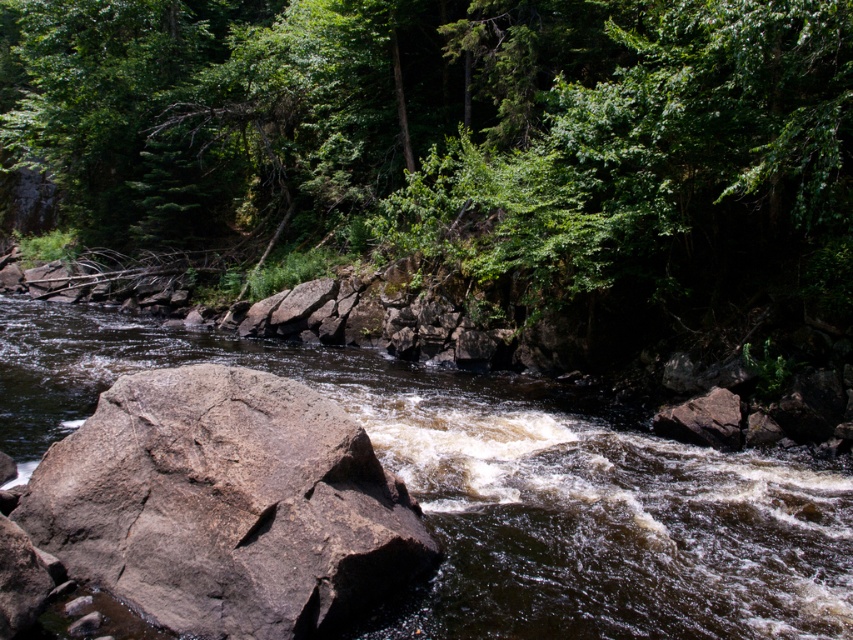
Which is in front, point (846, 220) or point (838, 580)?

Point (838, 580)

Who is positioned more to the right, green leafy tree at upper center or brown rock at center?

Positioned to the right is brown rock at center.

Where is `green leafy tree at upper center`? The image size is (853, 640). green leafy tree at upper center is located at coordinates (457, 134).

Is green leafy tree at upper center wider than gray rough rock at center?

Yes.

Is point (190, 60) less distant than point (189, 384)?

No, it is behind (189, 384).

The image size is (853, 640). I want to click on green leafy tree at upper center, so click(457, 134).

Can you confirm if brown rock at center is taller than gray rough rock at center?

Correct, brown rock at center is much taller as gray rough rock at center.

Does point (61, 403) come in front of point (247, 554)?

No, (61, 403) is further to viewer.

Image resolution: width=853 pixels, height=640 pixels. I want to click on brown rock at center, so (503, 488).